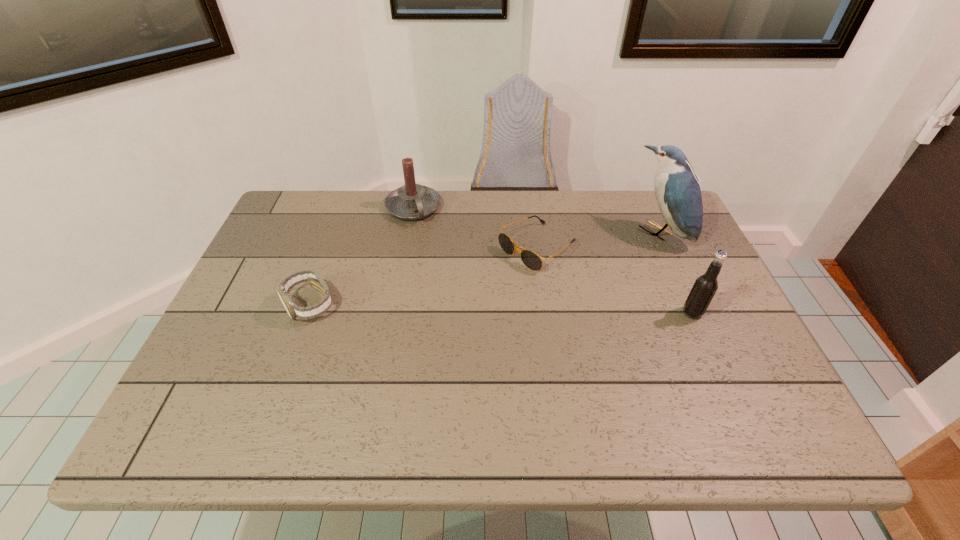
Where is `bird located at the far edge`? The width and height of the screenshot is (960, 540). bird located at the far edge is located at coordinates (677, 190).

At what (x,y) coordinates should I click in order to perform the action: click on object that is at the left edge. Please return your answer as a coordinate pair (x, y). Looking at the image, I should click on (315, 280).

The width and height of the screenshot is (960, 540). What are the coordinates of `root beer present at the right edge` in the screenshot? It's located at (705, 286).

Find the location of a particular element. The height and width of the screenshot is (540, 960). bird that is at the right edge is located at coordinates (677, 190).

You are a GUI agent. You are given a task and a screenshot of the screen. Output one action in this format:
    pyautogui.click(x=<x>, y=<y>)
    Task: Click on the object that is positioned at the far right corner
    The image size is (960, 540).
    Given the screenshot: What is the action you would take?
    pyautogui.click(x=677, y=190)

The height and width of the screenshot is (540, 960). What are the coordinates of `vacant region at the far edge of the desktop` in the screenshot? It's located at [457, 208].

Image resolution: width=960 pixels, height=540 pixels. Identify the location of vacant region at the left edge. (288, 314).

At what (x,y) coordinates should I click in order to perform the action: click on vacant space at the right edge. Please return your answer as a coordinate pair (x, y). The height and width of the screenshot is (540, 960). Looking at the image, I should click on (690, 257).

This screenshot has height=540, width=960. In the image, there is a desktop. What are the coordinates of `vacant space at the far left corner` in the screenshot? It's located at (282, 238).

In the image, there is a desktop. Where is `vacant region at the far right corner`? The height and width of the screenshot is (540, 960). vacant region at the far right corner is located at coordinates (645, 222).